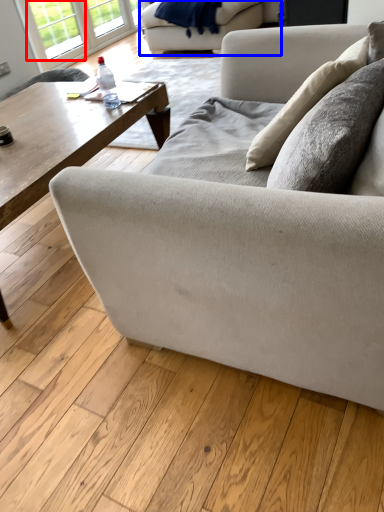
Question: Among these objects, which one is farthest to the camera, window (highlighted by a red box) or studio couch (highlighted by a blue box)?

Choices:
 (A) window
 (B) studio couch

Answer: (A)